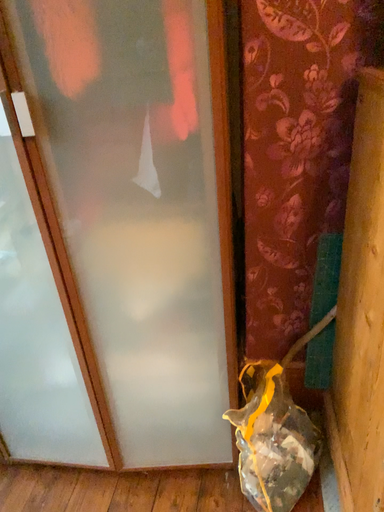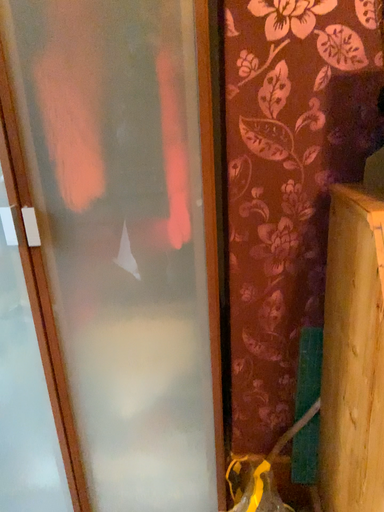
Question: Which way did the camera rotate in the video?

Choices:
 (A) rotated upward
 (B) rotated downward

Answer: (A)